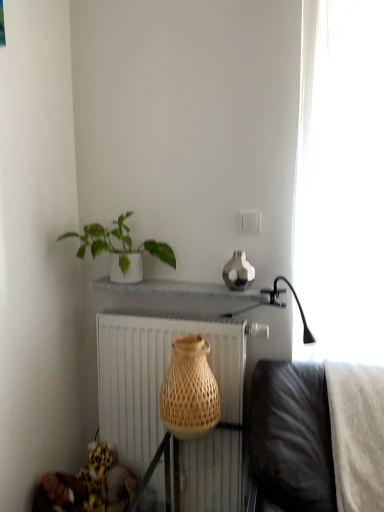
Find the location of a particular element. The image size is (384, 512). natural woven basket at center is located at coordinates (189, 390).

Locate an element on the screen. The height and width of the screenshot is (512, 384). white sheer curtain at right is located at coordinates (340, 181).

What is the approximate height of white matte radiator at center?

white matte radiator at center is 37.10 inches in height.

This screenshot has width=384, height=512. In order to click on white ceramic plant at upper left in this screenshot , I will do `click(119, 249)`.

In the scene shown: Which is closer to the camera, [177,369] or [100,359]?

Positioned in front is point [177,369].

Is natural woven basket at center to the right of white matte radiator at center from the viewer's perspective?

Indeed, natural woven basket at center is positioned on the right side of white matte radiator at center.

Is natural woven basket at center positioned with its back to white matte radiator at center?

Yes.

Is natural woven basket at center taller than white matte radiator at center?

In fact, natural woven basket at center may be shorter than white matte radiator at center.

Does point (371, 207) come behind point (154, 348)?

No, it is in front of (154, 348).

Can you confirm if white sheer curtain at right is positioned to the right of white matte radiator at center?

Correct, you'll find white sheer curtain at right to the right of white matte radiator at center.

From a real-world perspective, is white sheer curtain at right physically located above or below white matte radiator at center?

From a real-world perspective, white sheer curtain at right is physically above white matte radiator at center.

Considering the sizes of objects natural woven basket at center and white ceramic plant at upper left in the image provided, who is thinner, natural woven basket at center or white ceramic plant at upper left?

Thinner between the two is white ceramic plant at upper left.

From the image's perspective, is natural woven basket at center positioned above or below white ceramic plant at upper left?

From the image's perspective, natural woven basket at center appears below white ceramic plant at upper left.

From a real-world perspective, which is physically below, natural woven basket at center or white ceramic plant at upper left?

natural woven basket at center is physically lower.

Which object is wider, white ceramic plant at upper left or white matte radiator at center?

Wider between the two is white ceramic plant at upper left.

In the scene shown: From the image's perspective, would you say white ceramic plant at upper left is shown under white matte radiator at center?

Incorrect, from the image's perspective, white ceramic plant at upper left is higher than white matte radiator at center.

Can you confirm if white ceramic plant at upper left is shorter than white matte radiator at center?

Yes.

Could you tell me if white ceramic plant at upper left is facing white matte radiator at center?

No, white ceramic plant at upper left is not turned towards white matte radiator at center.

Is white matte radiator at center not near white ceramic plant at upper left?

No.

Which of these two, white matte radiator at center or white ceramic plant at upper left, stands shorter?

With less height is white ceramic plant at upper left.

In the image, is white matte radiator at center positioned in front of or behind white ceramic plant at upper left?

Clearly, white matte radiator at center is behind white ceramic plant at upper left.

Is white ceramic plant at upper left not within white sheer curtain at right?

white ceramic plant at upper left lies outside white sheer curtain at right's area.

Is the surface of white ceramic plant at upper left in direct contact with white sheer curtain at right?

white ceramic plant at upper left and white sheer curtain at right are clearly separated.

Is point (86, 239) closer or farther from the camera than point (346, 284)?

Point (86, 239) is positioned farther from the camera compared to point (346, 284).

Can you confirm if white ceramic plant at upper left is wider than white sheer curtain at right?

No, white ceramic plant at upper left is not wider than white sheer curtain at right.

Is white sheer curtain at right in front of or behind natural woven basket at center in the image?

Visually, white sheer curtain at right is located in front of natural woven basket at center.

Is white sheer curtain at right positioned far away from natural woven basket at center?

white sheer curtain at right is near natural woven basket at center, not far away.

From a real-world perspective, is white sheer curtain at right positioned above or below natural woven basket at center?

white sheer curtain at right is situated higher than natural woven basket at center in the real world.

Based on the photo, considering the sizes of white sheer curtain at right and natural woven basket at center in the image, is white sheer curtain at right taller or shorter than natural woven basket at center?

Considering their sizes, white sheer curtain at right has more height than natural woven basket at center.

Find the location of a particular element. radiator that is below the natural woven basket at center (from the image's perspective) is located at coordinates (157, 376).

You are a GUI agent. You are given a task and a screenshot of the screen. Output one action in this format:
    pyautogui.click(x=<x>, y=<y>)
    Task: Click on the radiator behind the white sheer curtain at right
    The width and height of the screenshot is (384, 512).
    Given the screenshot: What is the action you would take?
    pyautogui.click(x=157, y=376)

Looking at the image, which one is located closer to natural woven basket at center, white matte radiator at center or white sheer curtain at right?

The object closer to natural woven basket at center is white matte radiator at center.

Considering their positions, is white matte radiator at center positioned further to white ceramic plant at upper left than natural woven basket at center?

natural woven basket at center.

Based on their spatial positions, is white ceramic plant at upper left or white sheer curtain at right closer to white matte radiator at center?

Based on the image, white ceramic plant at upper left appears to be nearer to white matte radiator at center.

Estimate the real-world distances between objects in this image. Which object is closer to white matte radiator at center, natural woven basket at center or white ceramic plant at upper left?

The object closer to white matte radiator at center is natural woven basket at center.

Based on their spatial positions, is white ceramic plant at upper left or natural woven basket at center further from white matte radiator at center?

Among the two, white ceramic plant at upper left is located further to white matte radiator at center.

Looking at the image, which one is located closer to white matte radiator at center, white sheer curtain at right or natural woven basket at center?

The object closer to white matte radiator at center is natural woven basket at center.

In the scene shown: Estimate the real-world distances between objects in this image. Which object is further from white sheer curtain at right, white matte radiator at center or natural woven basket at center?

white matte radiator at center lies further to white sheer curtain at right than the other object.

In the scene shown: Considering their positions, is natural woven basket at center positioned further to white sheer curtain at right than white matte radiator at center?

white matte radiator at center is positioned further to the anchor white sheer curtain at right.

The image size is (384, 512). Find the location of `basket situated between white ceramic plant at upper left and white sheer curtain at right from left to right`. basket situated between white ceramic plant at upper left and white sheer curtain at right from left to right is located at coordinates (189, 390).

Image resolution: width=384 pixels, height=512 pixels. Find the location of `houseplant between white sheer curtain at right and white matte radiator at center in the vertical direction`. houseplant between white sheer curtain at right and white matte radiator at center in the vertical direction is located at coordinates (119, 249).

Locate an element on the screen. Image resolution: width=384 pixels, height=512 pixels. basket that lies between white sheer curtain at right and white matte radiator at center from top to bottom is located at coordinates (189, 390).

Locate an element on the screen. This screenshot has height=512, width=384. basket that lies between white ceramic plant at upper left and white matte radiator at center from top to bottom is located at coordinates (189, 390).